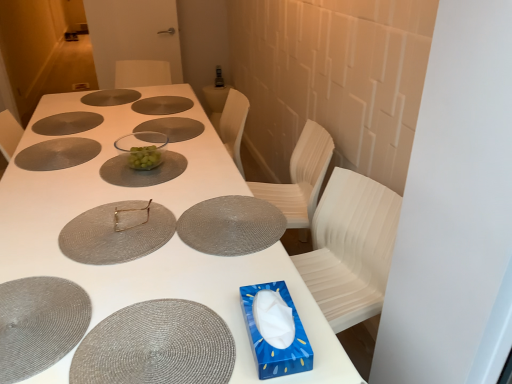
Locate an element on the screen. Image resolution: width=512 pixels, height=384 pixels. free space in front of transparent glass bowl at center is located at coordinates (125, 179).